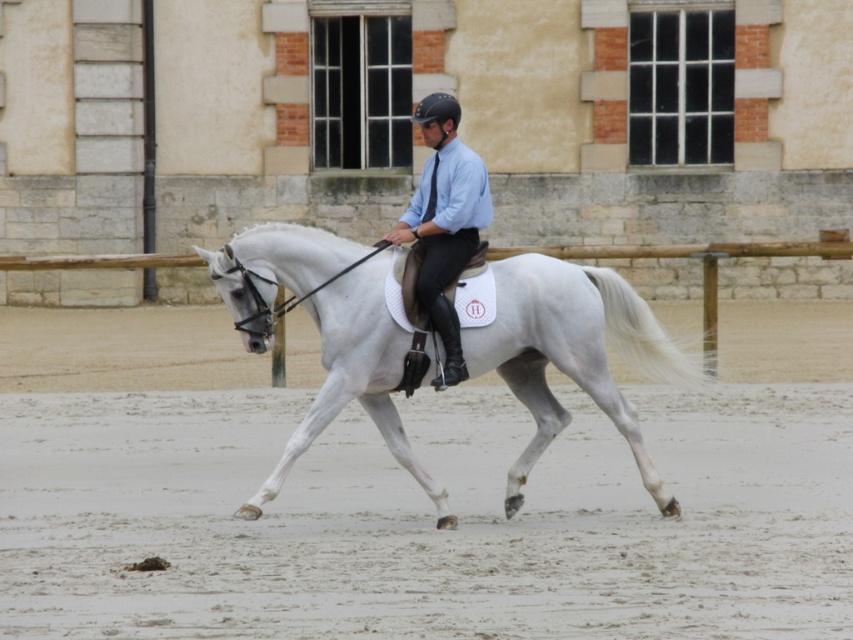
The height and width of the screenshot is (640, 853). Identify the location of white glossy horse at center. (572, 353).

Is white glossy horse at center below matte blue shirt at center?

Correct, white glossy horse at center is located below matte blue shirt at center.

Which is in front, point (485, 346) or point (437, 236)?

Point (485, 346) is more forward.

Image resolution: width=853 pixels, height=640 pixels. Identify the location of white glossy horse at center. (572, 353).

Who is more distant from viewer, (660, 444) or (299, 424)?

The point (299, 424) is behind.

Is sandy dirt track at center wider than white glossy horse at center?

Correct, the width of sandy dirt track at center exceeds that of white glossy horse at center.

This screenshot has width=853, height=640. What do you see at coordinates (426, 518) in the screenshot? I see `sandy dirt track at center` at bounding box center [426, 518].

The height and width of the screenshot is (640, 853). What are the coordinates of `sandy dirt track at center` in the screenshot? It's located at (426, 518).

Can you confirm if sandy dirt track at center is smaller than matte blue shirt at center?

No.

Is sandy dirt track at center to the left of matte blue shirt at center from the viewer's perspective?

No, sandy dirt track at center is not to the left of matte blue shirt at center.

Measure the distance between sandy dirt track at center and camera.

sandy dirt track at center and camera are 32.33 feet apart.

Find the location of a particular element. sandy dirt track at center is located at coordinates (426, 518).